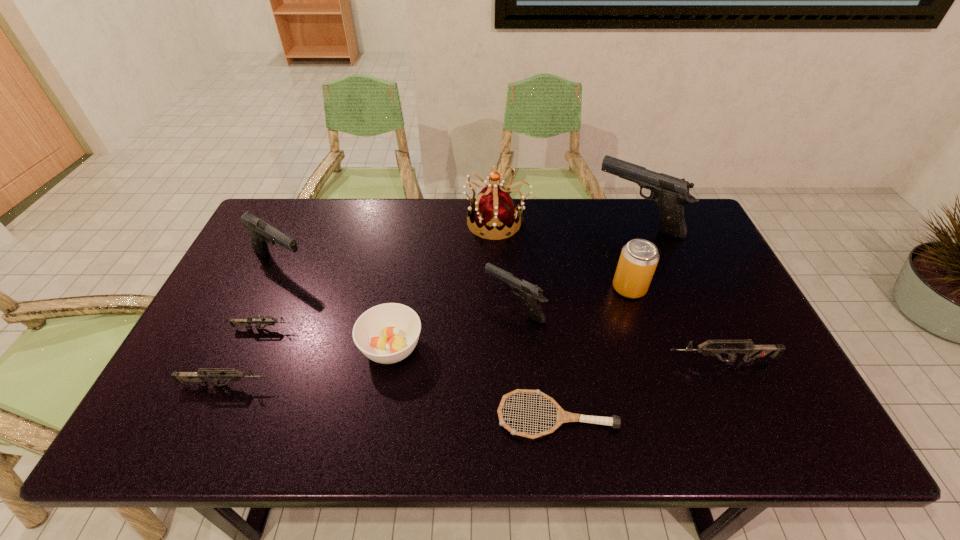
Identify the location of tiara. This screenshot has width=960, height=540. (494, 209).

The height and width of the screenshot is (540, 960). Find the location of `the biggest black gun`. the biggest black gun is located at coordinates (670, 193).

I want to click on the farthest gun, so click(x=670, y=193).

Locate an element on the screen. the second tallest gun is located at coordinates (261, 233).

At what (x,y) coordinates should I click in order to perform the action: click on the second farthest black gun. Please return your answer as a coordinate pair (x, y). Looking at the image, I should click on (261, 233).

What are the coordinates of `pop (soda)` in the screenshot? It's located at (639, 258).

At what (x,y) coordinates should I click in order to perform the action: click on the fourth shortest gun. Please return your answer as a coordinate pair (x, y). The width and height of the screenshot is (960, 540). Looking at the image, I should click on (532, 295).

Where is `the nearest black gun`? the nearest black gun is located at coordinates (532, 295).

You are a GUI agent. You are given a task and a screenshot of the screen. Output one action in this format:
    pyautogui.click(x=<x>, y=<y>)
    Task: Click on the second nearest gun
    This screenshot has width=960, height=540.
    Given the screenshot: What is the action you would take?
    click(x=752, y=351)

Locate an element on the screen. This screenshot has height=540, width=960. the biggest grey gun is located at coordinates (752, 351).